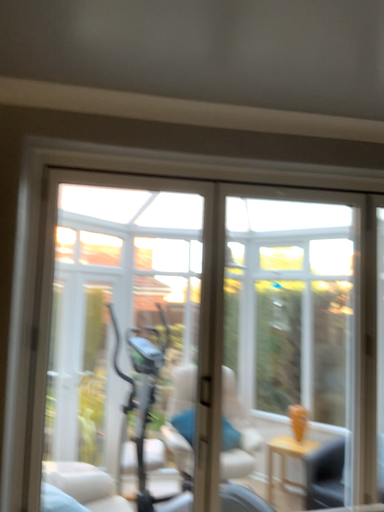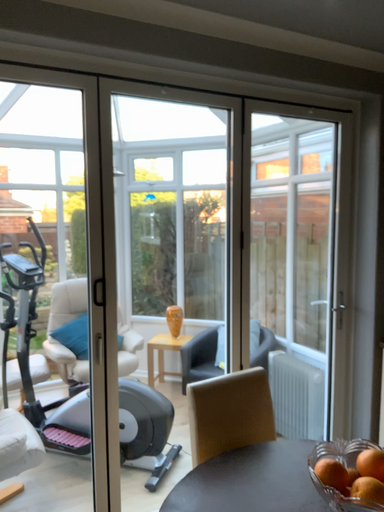
Question: How did the camera likely rotate when shooting the video?

Choices:
 (A) rotated right
 (B) rotated left

Answer: (A)